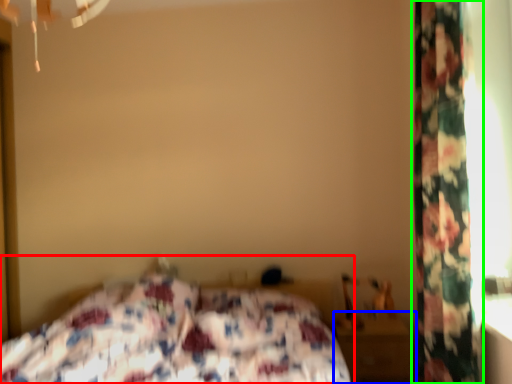
Question: Based on their relative distances, which object is nearer to bed (highlighted by a red box)? Choose from nightstand (highlighted by a blue box) and curtain (highlighted by a green box).

Choices:
 (A) nightstand
 (B) curtain

Answer: (A)